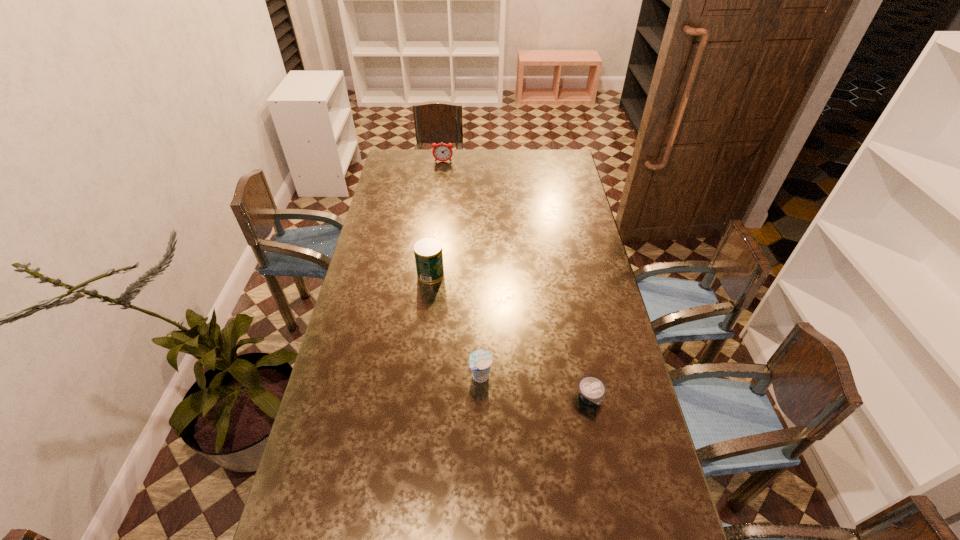
Image resolution: width=960 pixels, height=540 pixels. What are the coordinates of `the tallest object` in the screenshot? It's located at (428, 253).

Locate an element on the screen. The image size is (960, 540). the second farthest object is located at coordinates pyautogui.click(x=428, y=253).

The height and width of the screenshot is (540, 960). In order to click on the farthest object in this screenshot , I will do `click(442, 152)`.

The image size is (960, 540). Find the location of `alarm clock`. alarm clock is located at coordinates (442, 152).

The height and width of the screenshot is (540, 960). I want to click on the third object from left to right, so click(480, 361).

Where is `the left yogurt`? The image size is (960, 540). the left yogurt is located at coordinates (480, 361).

At what (x,y) coordinates should I click in order to perform the action: click on the right yogurt. Please return your answer as a coordinate pair (x, y). Looking at the image, I should click on (592, 390).

You are a GUI agent. You are given a task and a screenshot of the screen. Output one action in this format:
    pyautogui.click(x=<x>, y=<y>)
    Task: Click on the rightmost object
    Image resolution: width=960 pixels, height=540 pixels.
    Given the screenshot: What is the action you would take?
    pyautogui.click(x=592, y=390)

Locate an element on the screen. Image resolution: width=960 pixels, height=540 pixels. blank space located 0.390m on the back of the third nearest object is located at coordinates (439, 205).

Where is `vacant space located 0.140m on the front-facing side of the alarm clock`? This screenshot has height=540, width=960. vacant space located 0.140m on the front-facing side of the alarm clock is located at coordinates [442, 178].